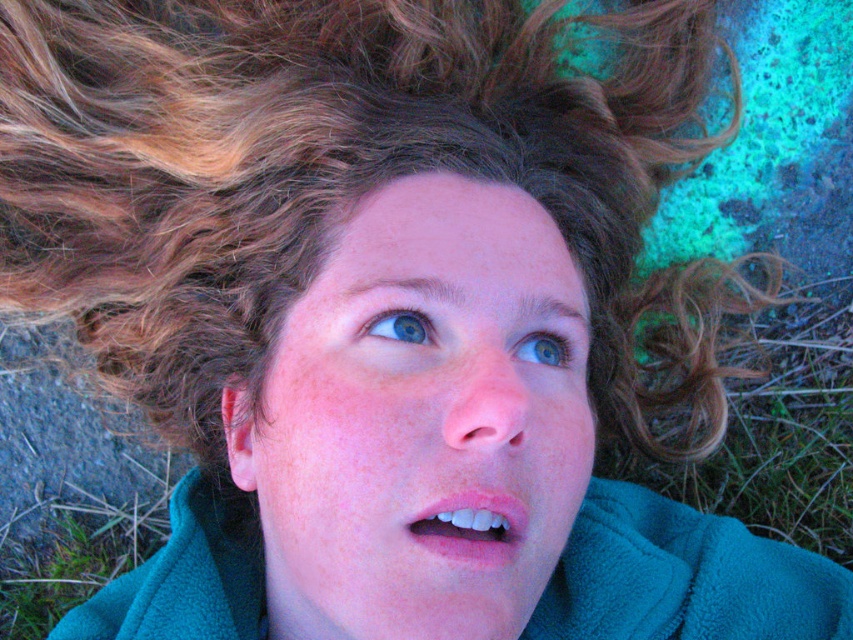
You are an artist analyzing the eyes of the person in the image. Both the blue matte eye at upper center and the blue glossy eye at upper center are visible. Which of these eyes takes up more space in the image?

The blue glossy eye at upper center takes up more space in the image because it occupies more space than the blue matte eye at upper center.

You are a photographer adjusting the lighting for a portrait. You notice the teal fleece robe at center and the blue matte eye at upper center in the frame. Which object is located to the right of the other?

The teal fleece robe at center is positioned on the right side of blue matte eye at upper center, so the teal fleece robe at center is to the right of the blue matte eye at upper center.

You are a photographer adjusting your camera to focus on the smooth skin face at center and the teal fleece robe at center. Which object should you focus on first to ensure it appears sharp in the photo?

The smooth skin face at center is closer to the viewer than the teal fleece robe at center, so you should focus on the smooth skin face at center first to ensure it appears sharp.